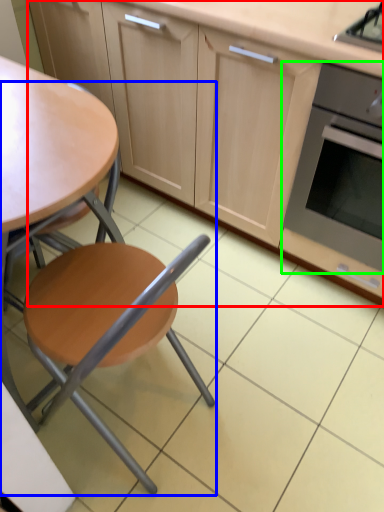
Question: Considering the real-world distances, which object is farthest from cabinetry (highlighted by a red box)? chair (highlighted by a blue box) or kitchen appliance (highlighted by a green box)?

Choices:
 (A) chair
 (B) kitchen appliance

Answer: (A)